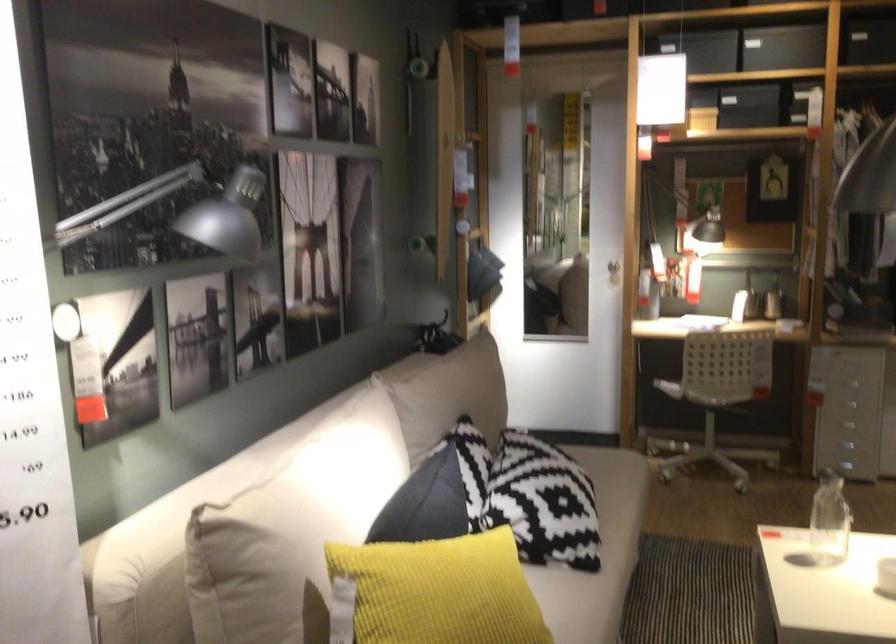
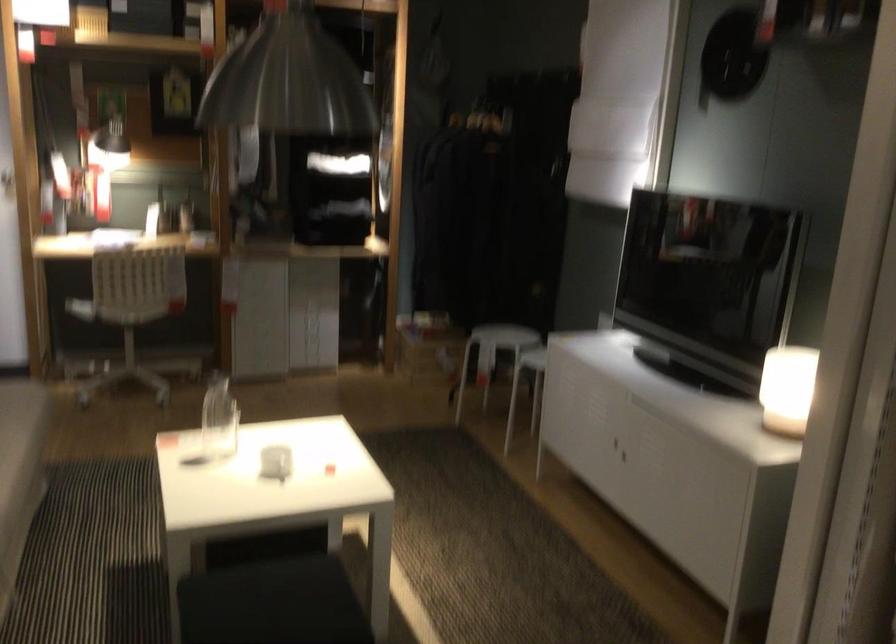
Question: The first image is from the beginning of the video and the second image is from the end. How did the camera likely rotate when shooting the video?

Choices:
 (A) Left
 (B) Right
 (C) Up
 (D) Down

Answer: (B)